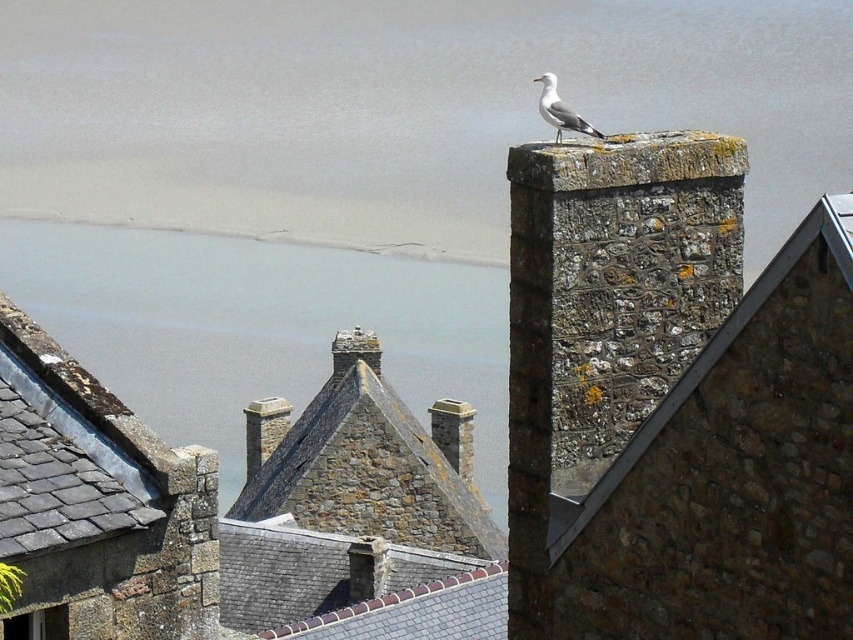
Question: Where is gray stone water at upper center located in relation to white feathered bird at upper center in the image?

Choices:
 (A) right
 (B) left

Answer: (B)

Question: Does gray stone water at upper center have a larger size compared to white feathered bird at upper center?

Choices:
 (A) no
 (B) yes

Answer: (B)

Question: Does gray stone water at upper center have a greater width compared to white feathered bird at upper center?

Choices:
 (A) no
 (B) yes

Answer: (B)

Question: Among these points, which one is farthest from the camera?

Choices:
 (A) (572, 118)
 (B) (473, 304)

Answer: (B)